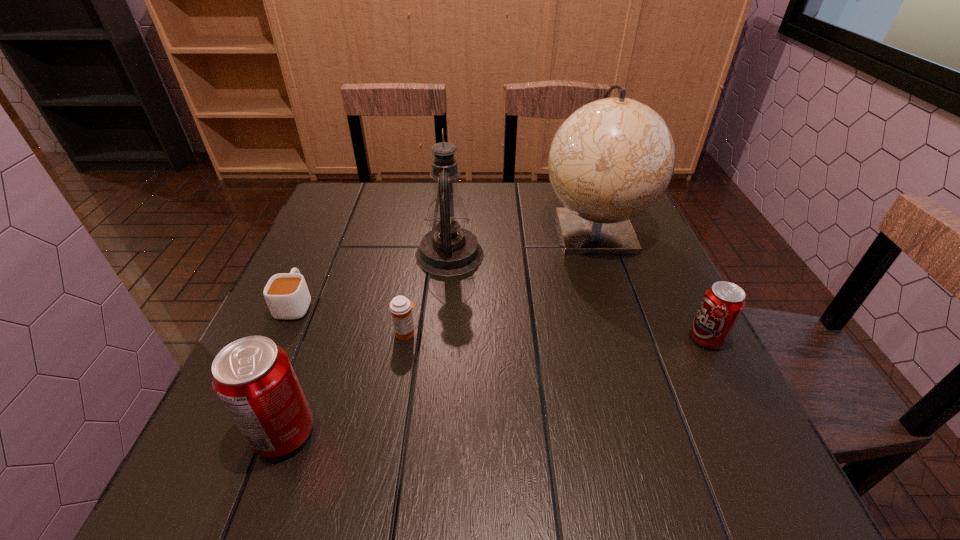
This screenshot has width=960, height=540. Identify the location of free area in between the third tallest object and the medicine. (345, 383).

At what (x,y) coordinates should I click in order to perform the action: click on the fourth closest object to the oil lamp. Please return your answer as a coordinate pair (x, y). This screenshot has height=540, width=960. Looking at the image, I should click on (253, 378).

You are a GUI agent. You are given a task and a screenshot of the screen. Output one action in this format:
    pyautogui.click(x=<x>, y=<y>)
    Task: Click on the object that ranks as the closest to the oil lamp
    The image size is (960, 540).
    Given the screenshot: What is the action you would take?
    pyautogui.click(x=612, y=159)

The width and height of the screenshot is (960, 540). Find the location of `free space that satisfies the following two spatial constraints: 1. on the surface of the right soda showing Europe and Africa; 2. on the right side of the globe`. free space that satisfies the following two spatial constraints: 1. on the surface of the right soda showing Europe and Africa; 2. on the right side of the globe is located at coordinates (631, 339).